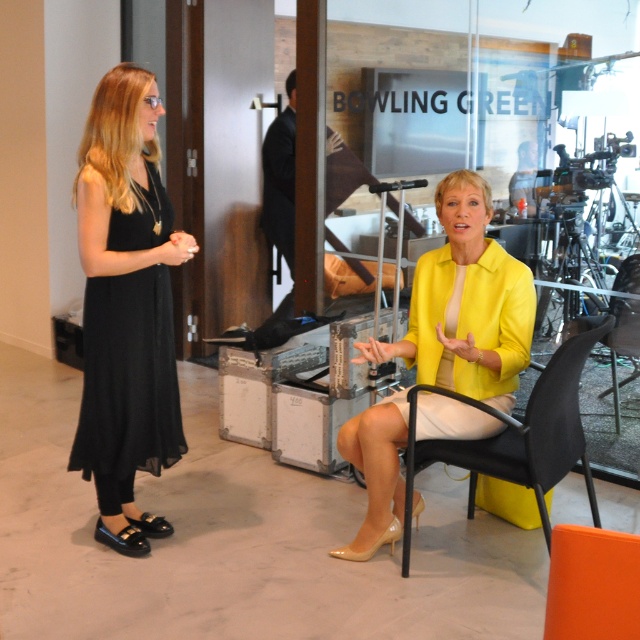
Is black chiffon dress at left positioned behind black plastic chair at center?

Yes, black chiffon dress at left is behind black plastic chair at center.

Does point (106, 346) lie in front of point (564, 342)?

No, (106, 346) is further to viewer.

This screenshot has height=640, width=640. What do you see at coordinates (129, 376) in the screenshot?
I see `black chiffon dress at left` at bounding box center [129, 376].

The height and width of the screenshot is (640, 640). In order to click on black chiffon dress at left in this screenshot , I will do `click(129, 376)`.

Who is shorter, black chiffon dress at left or black plastic chair at lower right?

black plastic chair at lower right is shorter.

Between black chiffon dress at left and black plastic chair at lower right, which one appears on the right side from the viewer's perspective?

From the viewer's perspective, black plastic chair at lower right appears more on the right side.

Is point (148, 284) closer to viewer compared to point (627, 259)?

Yes.

Locate an element on the screen. The image size is (640, 640). black chiffon dress at left is located at coordinates (129, 376).

Between yellow matte blazer at center and black plastic chair at lower right, which one is positioned higher?

Positioned higher is black plastic chair at lower right.

Is yellow matte blazer at center taller than black plastic chair at lower right?

Yes, yellow matte blazer at center is taller than black plastic chair at lower right.

Find the location of `yellow matte blazer at center`. yellow matte blazer at center is located at coordinates (465, 305).